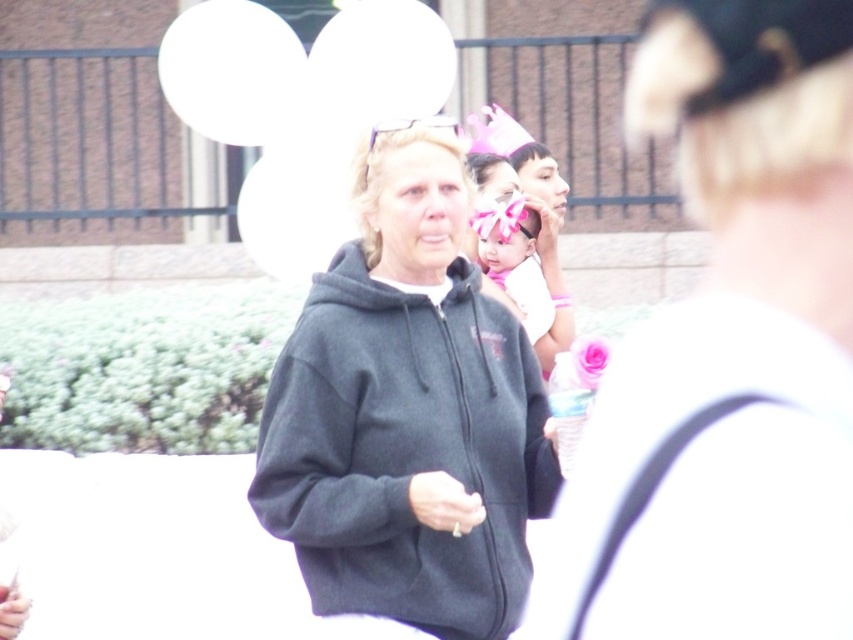
Question: Among these points, which one is farthest from the camera?

Choices:
 (A) (409, 288)
 (B) (505, 253)

Answer: (B)

Question: Considering the relative positions of dark gray hoodie at center and pink satin headband at center in the image provided, where is dark gray hoodie at center located with respect to pink satin headband at center?

Choices:
 (A) above
 (B) below

Answer: (B)

Question: Is dark gray hoodie at center wider than pink satin headband at center?

Choices:
 (A) yes
 (B) no

Answer: (B)

Question: From the image, what is the correct spatial relationship of dark gray hoodie at center in relation to pink satin headband at center?

Choices:
 (A) below
 (B) above

Answer: (A)

Question: Which point is closer to the camera?

Choices:
 (A) (376, 500)
 (B) (502, 240)

Answer: (A)